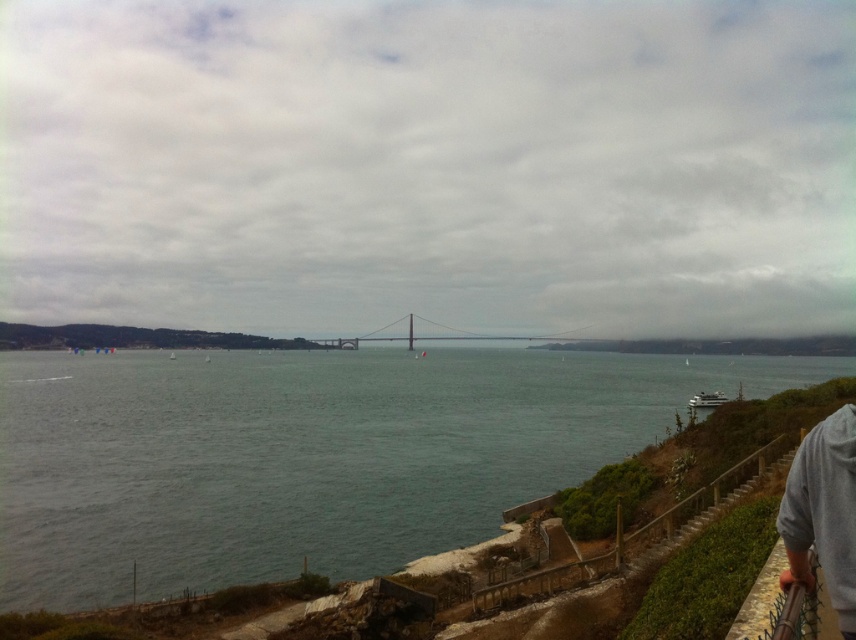
Question: Does gray hoodie at lower right appear under metallic gray bridge at center?

Choices:
 (A) no
 (B) yes

Answer: (B)

Question: Is greenish water at center below gray hoodie at lower right?

Choices:
 (A) yes
 (B) no

Answer: (A)

Question: Estimate the real-world distances between objects in this image. Which object is farther from the gray hoodie at lower right?

Choices:
 (A) metallic gray bridge at center
 (B) greenish water at center

Answer: (A)

Question: Which of these objects is positioned closest to the gray hoodie at lower right?

Choices:
 (A) greenish water at center
 (B) metallic gray bridge at center

Answer: (A)

Question: Is gray hoodie at lower right to the right of metallic gray bridge at center from the viewer's perspective?

Choices:
 (A) yes
 (B) no

Answer: (B)

Question: Which point is closer to the camera?

Choices:
 (A) gray hoodie at lower right
 (B) greenish water at center

Answer: (A)